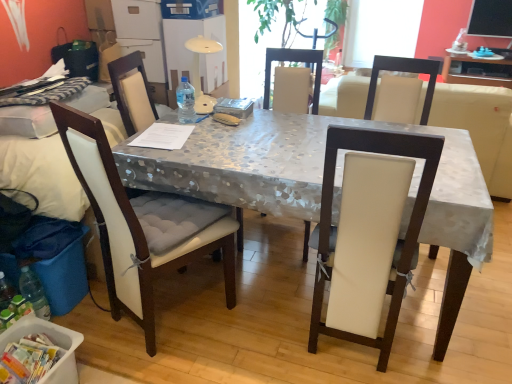
I want to click on free spot above white plastic container at lower left (from a real-world perspective), so pyautogui.click(x=33, y=331).